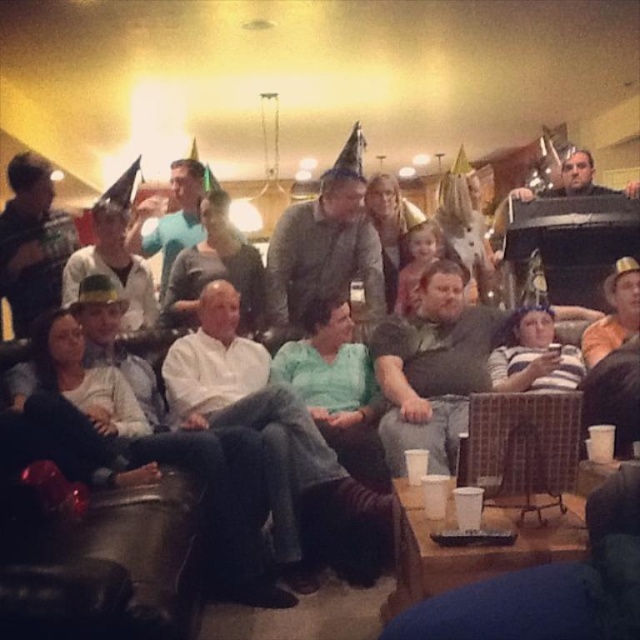
Who is positioned more to the left, white cotton shirt at center or dark gray sweater at center?

Positioned to the left is white cotton shirt at center.

Is white cotton shirt at center to the right of dark gray sweater at center from the viewer's perspective?

Incorrect, white cotton shirt at center is not on the right side of dark gray sweater at center.

Which is in front, point (234, 301) or point (372, 356)?

Positioned in front is point (234, 301).

Identify the location of white cotton shirt at center. The height and width of the screenshot is (640, 640). (278, 448).

Is dark gray sweater at center thinner than matte green hat at center?

No.

Does point (467, 419) lie behind point (96, 230)?

No, it is in front of (96, 230).

Locate an element on the screen. The image size is (640, 640). dark gray sweater at center is located at coordinates (433, 368).

What do you see at coordinates (33, 243) in the screenshot? I see `matte black shirt at left` at bounding box center [33, 243].

Which is in front, point (36, 196) or point (150, 276)?

Positioned in front is point (36, 196).

Where is `matte black shirt at left`? Image resolution: width=640 pixels, height=640 pixels. matte black shirt at left is located at coordinates (33, 243).